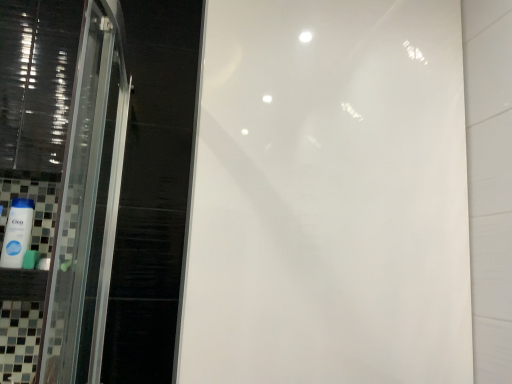
Question: Relative to green matte sponge at lower left, is white glossy mouthwash at lower left in front or behind?

Choices:
 (A) front
 (B) behind

Answer: (A)

Question: Is point (7, 220) positioned closer to the camera than point (26, 263)?

Choices:
 (A) farther
 (B) closer

Answer: (B)

Question: From the image's perspective, relative to green matte sponge at lower left, is white glossy mouthwash at lower left above or below?

Choices:
 (A) above
 (B) below

Answer: (A)

Question: Does point click(25, 261) appear closer or farther from the camera than point click(7, 231)?

Choices:
 (A) closer
 (B) farther

Answer: (B)

Question: From their relative heights in the image, would you say green matte sponge at lower left is taller or shorter than white glossy mouthwash at lower left?

Choices:
 (A) tall
 (B) short

Answer: (B)

Question: Is green matte sponge at lower left bigger or smaller than white glossy mouthwash at lower left?

Choices:
 (A) small
 (B) big

Answer: (A)

Question: Considering the positions of green matte sponge at lower left and white glossy mouthwash at lower left in the image, is green matte sponge at lower left wider or thinner than white glossy mouthwash at lower left?

Choices:
 (A) thin
 (B) wide

Answer: (A)